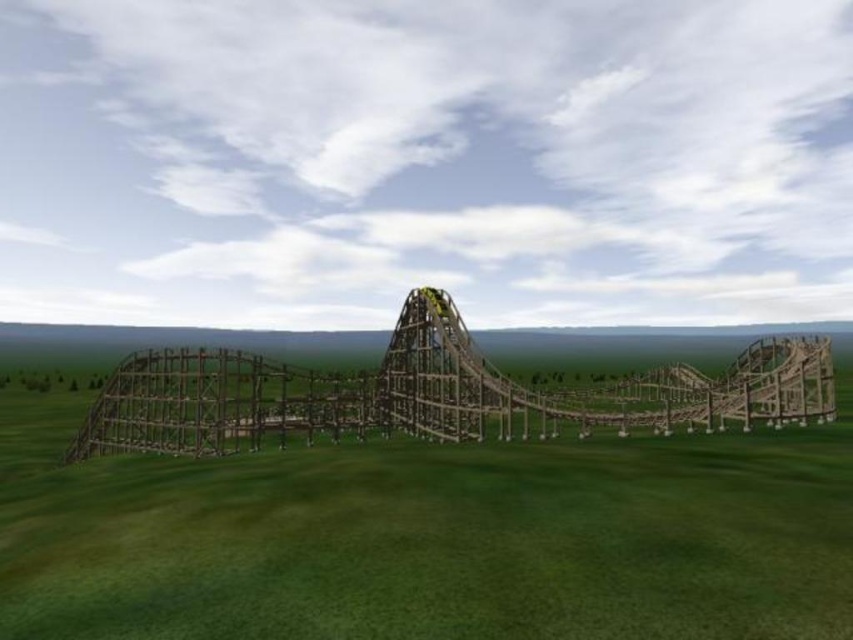
This screenshot has width=853, height=640. Describe the element at coordinates (428, 536) in the screenshot. I see `green grassy at center` at that location.

Can you confirm if green grassy at center is positioned above brown wooden roller coaster at center?

Yes, green grassy at center is above brown wooden roller coaster at center.

What do you see at coordinates (428, 536) in the screenshot?
I see `green grassy at center` at bounding box center [428, 536].

Locate an element on the screen. The width and height of the screenshot is (853, 640). green grassy at center is located at coordinates (428, 536).